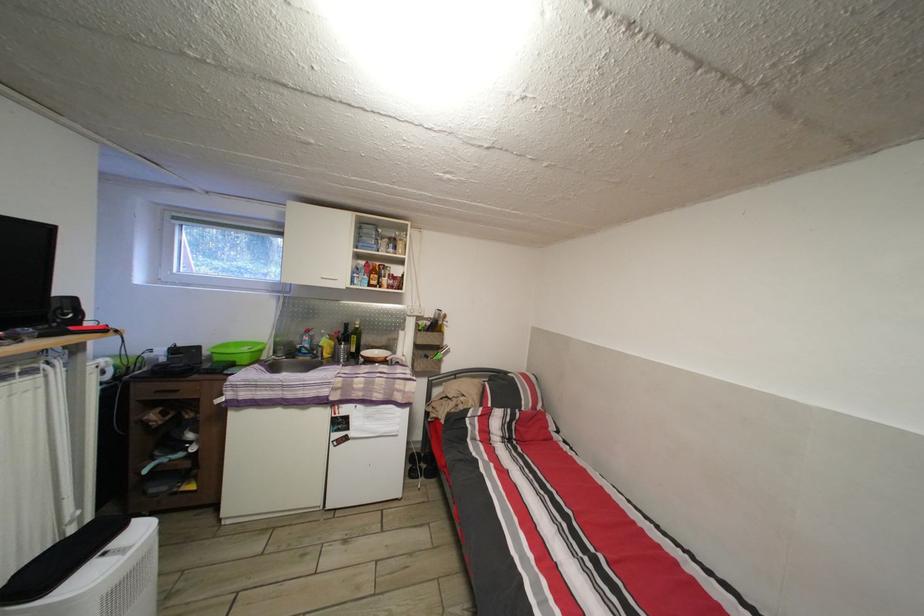
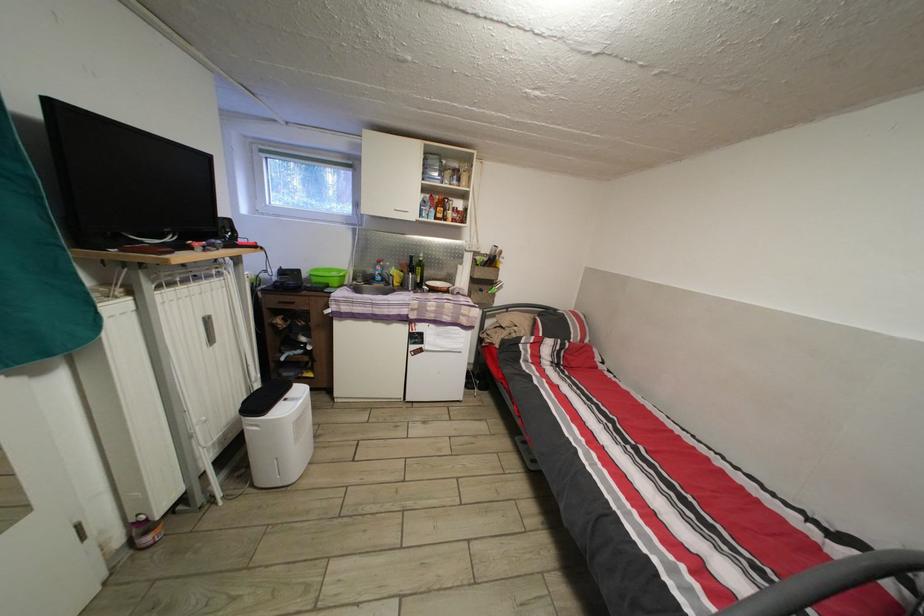
The images are taken continuously from a first-person perspective. In which direction are you moving?

The movement direction of the cameraman is left, backward.